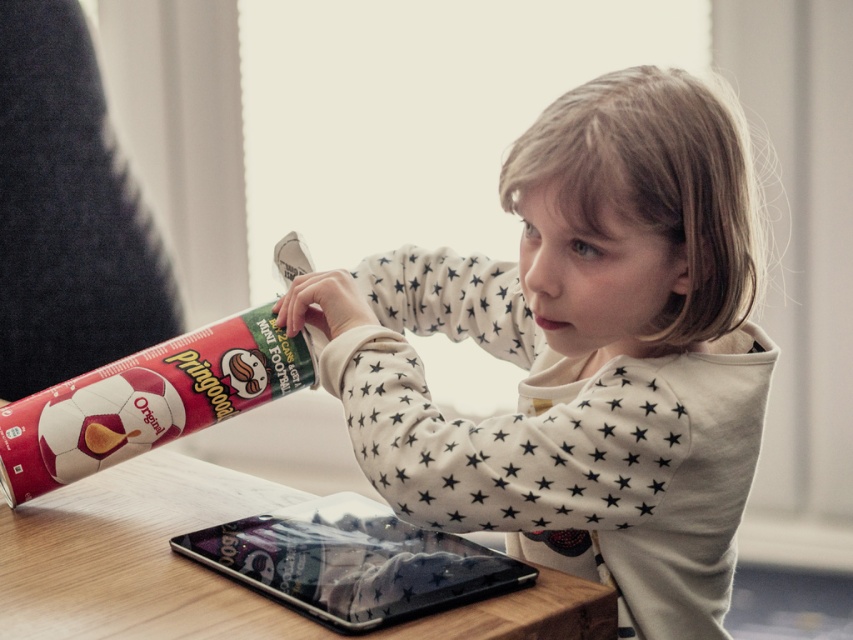
Measure the distance between point (77, 625) and camera.

The distance of point (77, 625) from camera is 32.24 inches.

Who is positioned more to the left, wooden table at center or transparent plastic tablet at center?

wooden table at center is more to the left.

Is point (254, 508) positioned in front of point (392, 540)?

No, it is behind (392, 540).

Where is `wooden table at center`? wooden table at center is located at coordinates (210, 570).

Which of these two, white star-patterned sweater at center or wooden table at center, stands taller?

Standing taller between the two is white star-patterned sweater at center.

Does white star-patterned sweater at center have a lesser width compared to wooden table at center?

Indeed, white star-patterned sweater at center has a lesser width compared to wooden table at center.

Is point (469, 260) closer to viewer compared to point (114, 609)?

No, (469, 260) is further to viewer.

Locate an element on the screen. This screenshot has width=853, height=640. white star-patterned sweater at center is located at coordinates (581, 353).

Can you confirm if white star-patterned sweater at center is shorter than transparent plastic tablet at center?

In fact, white star-patterned sweater at center may be taller than transparent plastic tablet at center.

Does white star-patterned sweater at center appear on the right side of transparent plastic tablet at center?

Yes, white star-patterned sweater at center is to the right of transparent plastic tablet at center.

Does point (415, 328) come behind point (316, 508)?

Yes, point (415, 328) is farther from viewer.

This screenshot has width=853, height=640. Identify the location of white star-patterned sweater at center. (581, 353).